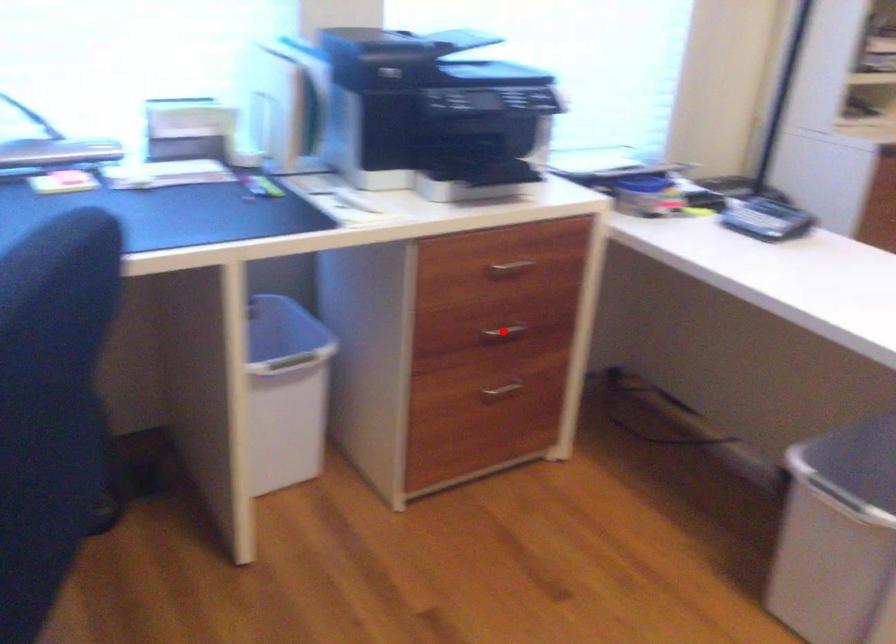
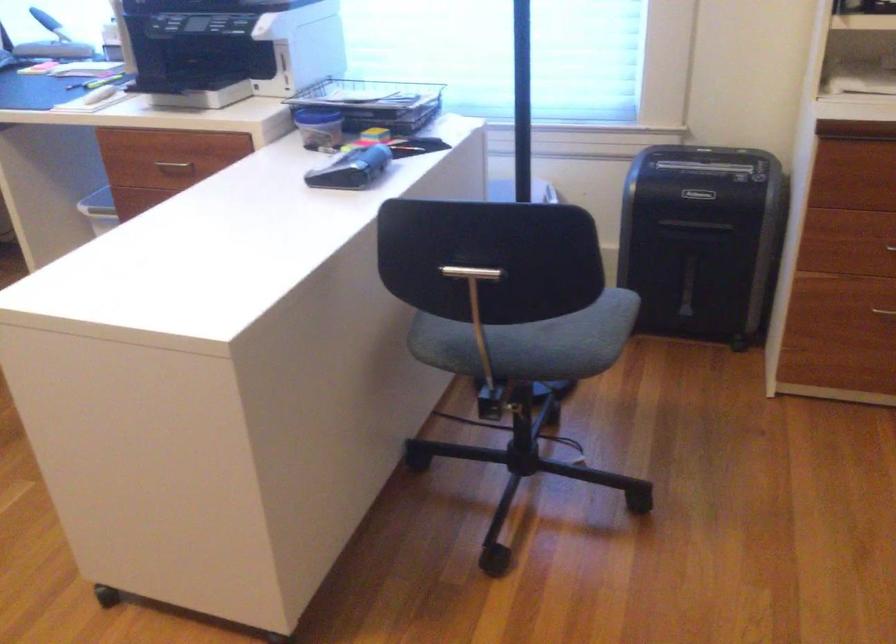
Question: I am providing you with two images of the same scene from different viewpoints. A red point is marked on the first image. Can you still see the location of the red point in image 2?

Choices:
 (A) Yes
 (B) No

Answer: (B)